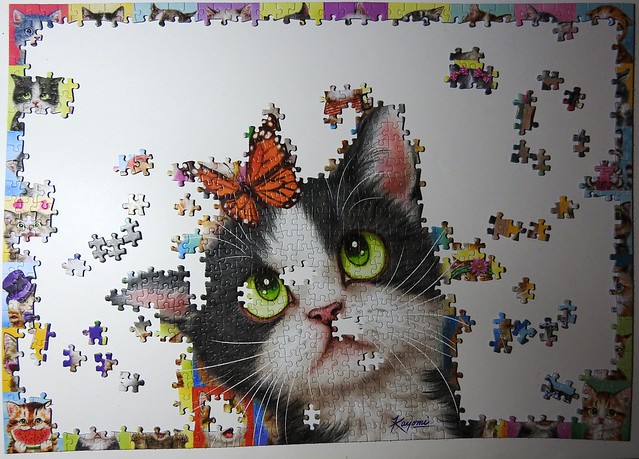
At what (x,y) coordinates should I click in order to perform the action: click on puzzle corner pieces. Please return your answer as a coordinate pair (x, y). Looking at the image, I should click on (12, 12), (629, 12), (620, 433), (13, 445).